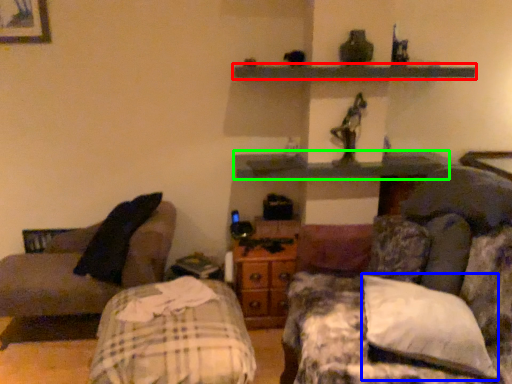
Question: Based on their relative distances, which object is nearer to shelf (highlighted by a red box)? Choose from pillow (highlighted by a blue box) and shelf (highlighted by a green box).

Choices:
 (A) pillow
 (B) shelf

Answer: (B)